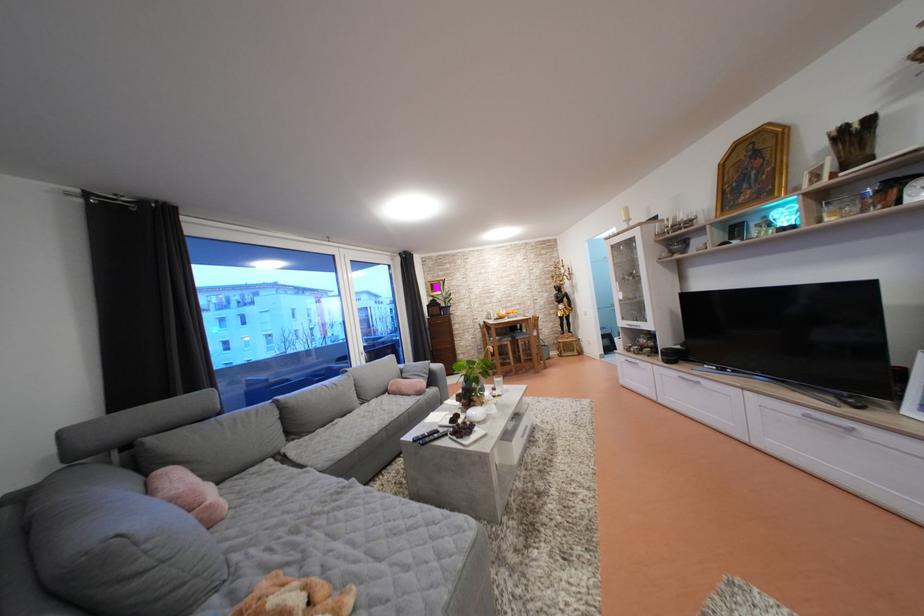
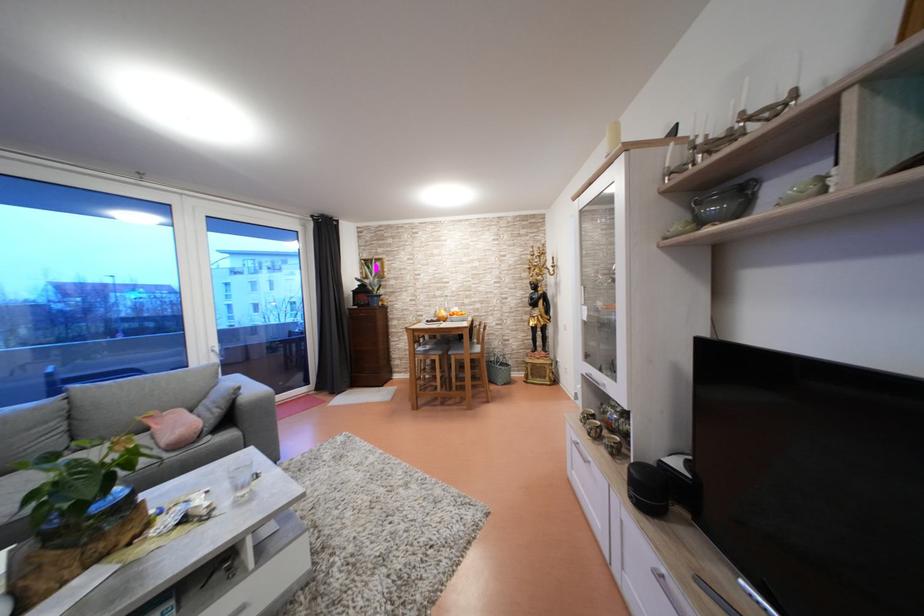
In the second image, find the point that corresponds to point (679, 362) in the first image.

(662, 500)